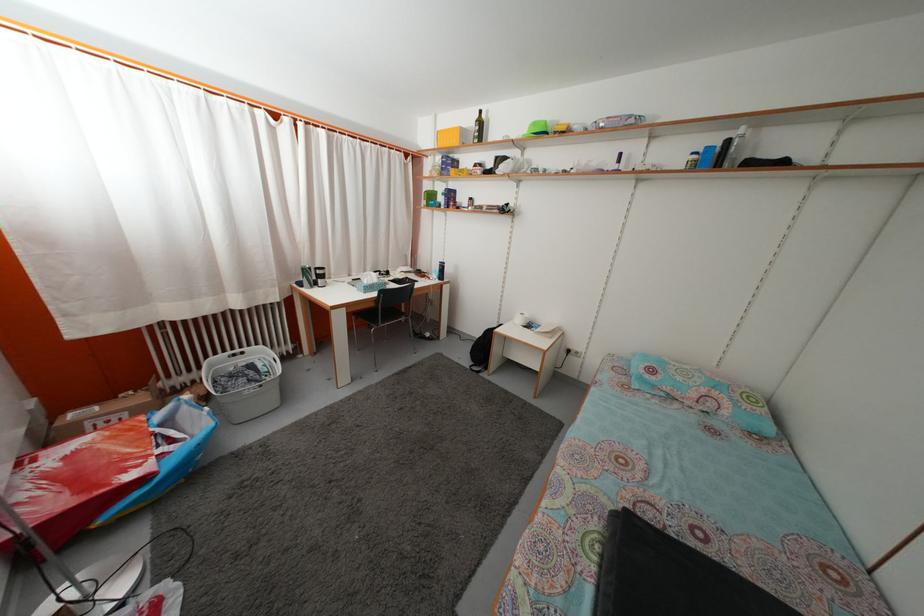
Find where to lift the black backpack. Please return your answer as a coordinate pair (x, y).

(481, 350)